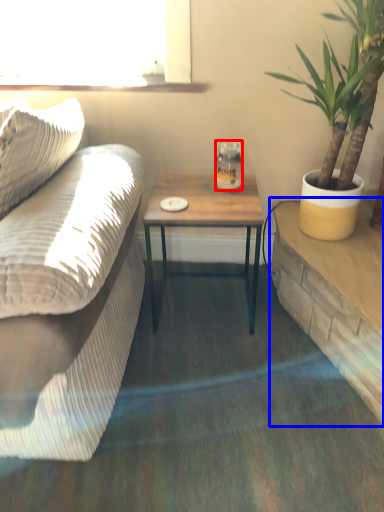
Question: Which object appears closest to the camera in this image, coffee cup (highlighted by a red box) or table (highlighted by a blue box)?

Choices:
 (A) coffee cup
 (B) table

Answer: (B)